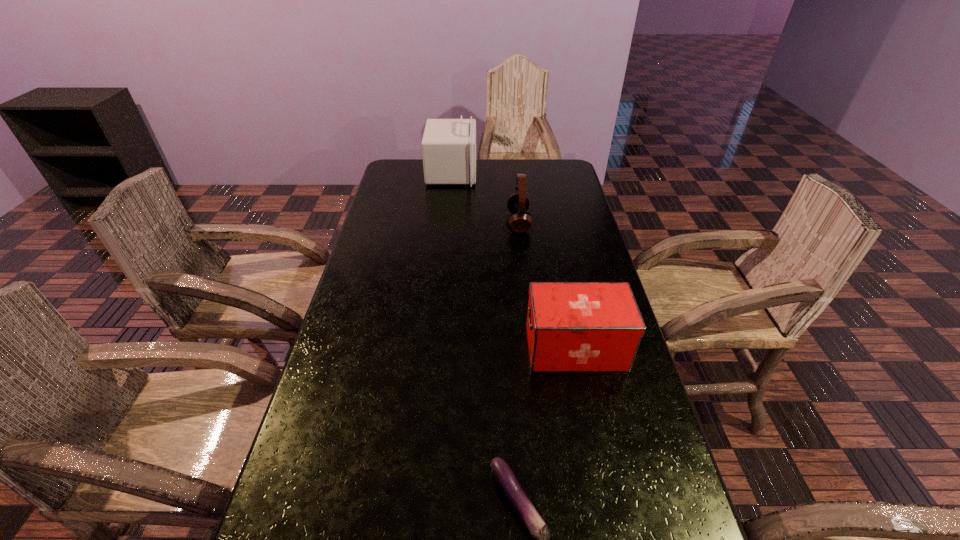
Identify the location of unoccupied position between the tallest object and the nearer first-aid kit. The height and width of the screenshot is (540, 960). coord(514,260).

The image size is (960, 540). I want to click on free space between the shorter first-aid kit and the tallest object, so click(514, 260).

Where is `vacant space that's between the third farthest object and the farthest object`? vacant space that's between the third farthest object and the farthest object is located at coordinates (514, 260).

Locate an element on the screen. object that is the third closest to the headset is located at coordinates (508, 483).

Select which object appears as the second closest to the nearest object. Please provide its 2D coordinates. Your answer should be formatted as a tuple, i.e. [(x, y)], where the tuple contains the x and y coordinates of a point satisfying the conditions above.

[(518, 204)]